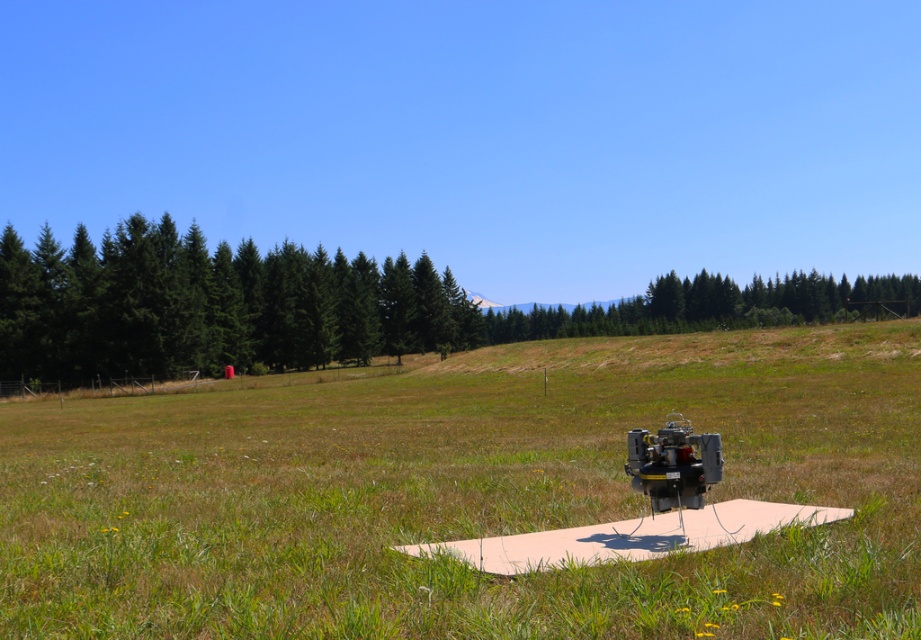
Is point (522, 513) farther from viewer compared to point (41, 301)?

No, (522, 513) is closer to viewer.

Does green grass at center have a lesser height compared to green matte trees at left?

Yes.

Is point (822, 369) less distant than point (194, 339)?

That is True.

Find the location of a particular element. Image resolution: width=921 pixels, height=640 pixels. green grass at center is located at coordinates [469, 493].

Can you confirm if green grass at center is positioned above green textured tree at center?

No.

Is green grass at center below green textured tree at center?

Indeed, green grass at center is positioned under green textured tree at center.

Who is more distant from viewer, [793,609] or [500,332]?

Positioned behind is point [500,332].

You are a GUI agent. You are given a task and a screenshot of the screen. Output one action in this format:
    pyautogui.click(x=<x>, y=<y>)
    Task: Click on the green grass at center
    
    Given the screenshot: What is the action you would take?
    pyautogui.click(x=469, y=493)

Can you confirm if green matte trees at left is taller than green textured tree at center?

In fact, green matte trees at left may be shorter than green textured tree at center.

Is green matte trees at left below green textured tree at center?

Yes, green matte trees at left is below green textured tree at center.

Locate an element on the screen. green matte trees at left is located at coordinates (212, 305).